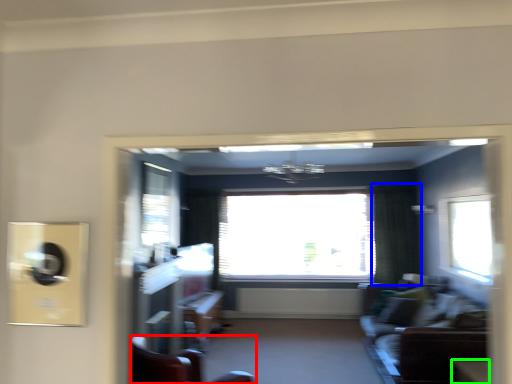
Question: Estimate the real-world distances between objects in this image. Which object is closer to furniture (highlighted by a red box), curtain (highlighted by a blue box) or table (highlighted by a green box)?

Choices:
 (A) curtain
 (B) table

Answer: (B)